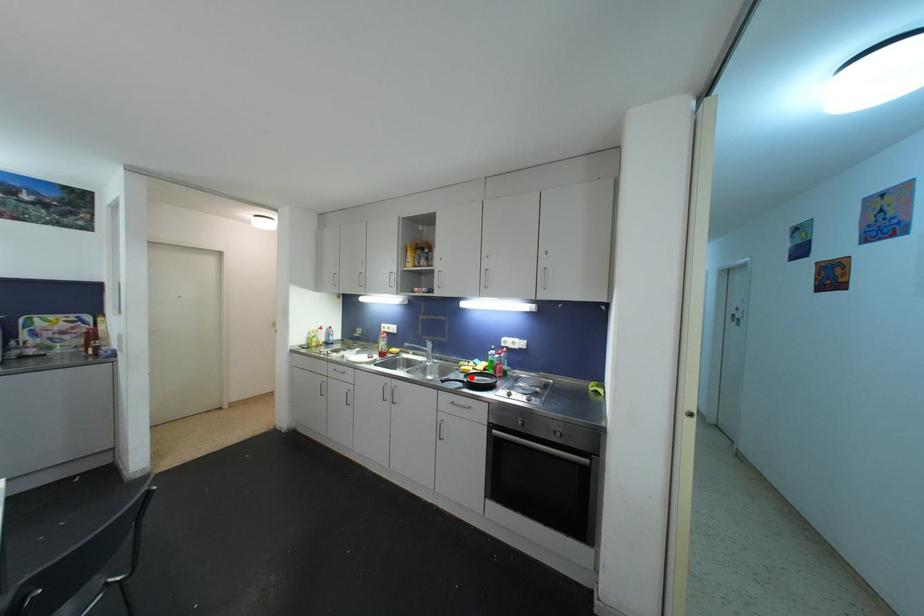
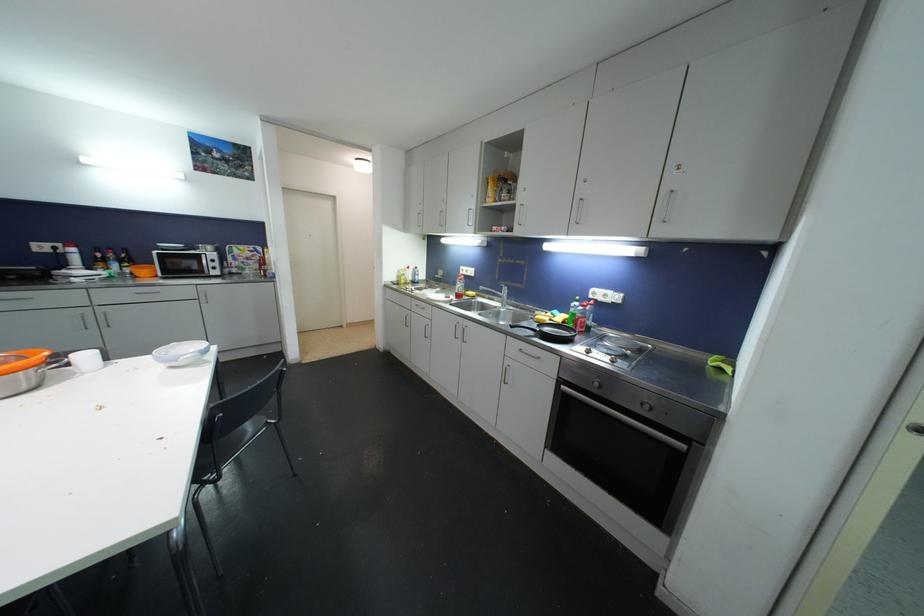
The point at the highlighted location is marked in the first image. Where is the corresponding point in the second image?

(544, 326)